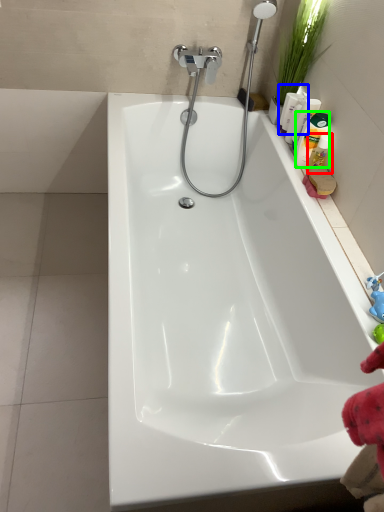
Question: Which object is positioned farthest from cleaning product (highlighted by a red box)? Select from cleaning product (highlighted by a blue box) and cleaning product (highlighted by a green box).

Choices:
 (A) cleaning product
 (B) cleaning product

Answer: (A)